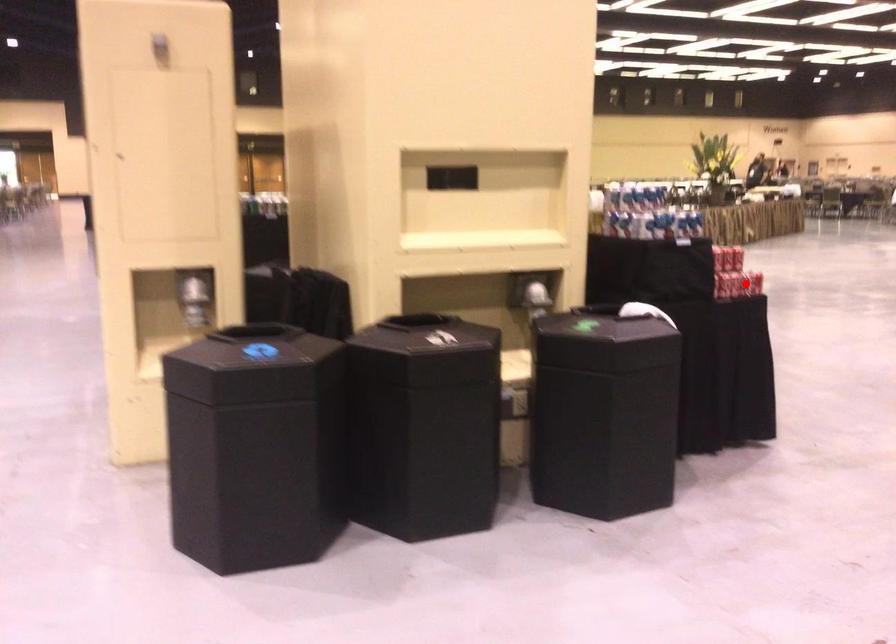
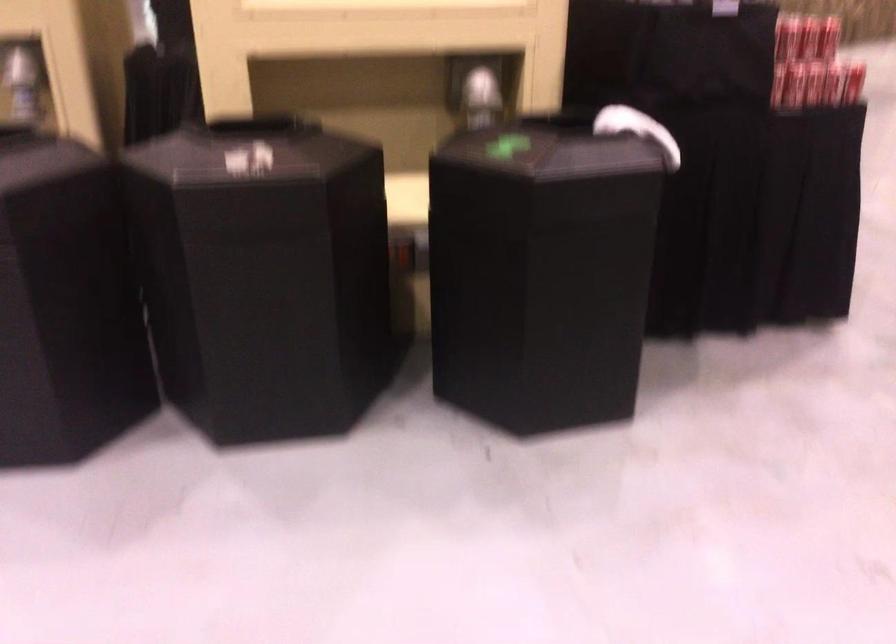
The point at the highlighted location is marked in the first image. Where is the corresponding point in the second image?

(810, 84)